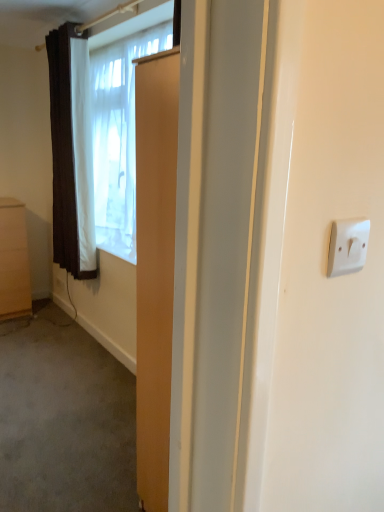
Locate an element on the screen. white sheer curtain at upper left is located at coordinates (72, 151).

This screenshot has height=512, width=384. In order to click on brown textured curtain at left in this screenshot , I will do `click(72, 152)`.

Identify the location of matte brown cabinet at left. (14, 260).

Which of these two, matte brown cabinet at left or white sheer curtain at upper left, is thinner?

Thinner between the two is white sheer curtain at upper left.

Is matte brown cabinet at left beside white sheer curtain at upper left?

No, matte brown cabinet at left is not making contact with white sheer curtain at upper left.

Can you confirm if matte brown cabinet at left is positioned to the right of white sheer curtain at upper left?

No, matte brown cabinet at left is not to the right of white sheer curtain at upper left.

How distant is matte brown cabinet at left from white sheer curtain at upper left?

The distance of matte brown cabinet at left from white sheer curtain at upper left is 90.15 centimeters.

Which is more to the left, brown textured curtain at left or matte brown cabinet at left?

matte brown cabinet at left is more to the left.

Where is `curtain above the matte brown cabinet at left (from the image's perspective)`? curtain above the matte brown cabinet at left (from the image's perspective) is located at coordinates (72, 152).

Is point (82, 128) closer or farther from the camera than point (10, 238)?

Clearly, point (82, 128) is closer to the camera than point (10, 238).

Considering the relative positions of brown textured curtain at left and matte brown cabinet at left in the image provided, is brown textured curtain at left in front of matte brown cabinet at left?

Yes, it is in front of matte brown cabinet at left.

Does point (78, 223) lie behind point (14, 285)?

That is False.

Can you confirm if white sheer curtain at upper left is wider than matte brown cabinet at left?

In fact, white sheer curtain at upper left might be narrower than matte brown cabinet at left.

Which object is positioned more to the right, white sheer curtain at upper left or matte brown cabinet at left?

white sheer curtain at upper left.

Would you say matte brown cabinet at left is part of white sheer curtain at upper left's contents?

No.

From the image's perspective, which one is positioned lower, brown textured curtain at left or white sheer curtain at upper left?

white sheer curtain at upper left, from the image's perspective.

Considering the relative positions of brown textured curtain at left and white sheer curtain at upper left in the image provided, is brown textured curtain at left behind white sheer curtain at upper left?

Yes, the depth of brown textured curtain at left is greater than that of white sheer curtain at upper left.

Looking at this image, could you tell me if brown textured curtain at left is turned towards white sheer curtain at upper left?

No, brown textured curtain at left is not turned towards white sheer curtain at upper left.

Between brown textured curtain at left and white sheer curtain at upper left, which one has more height?

With more height is brown textured curtain at left.

How far apart are matte brown cabinet at left and brown textured curtain at left?

matte brown cabinet at left and brown textured curtain at left are 32.20 inches apart from each other.

Is matte brown cabinet at left next to brown textured curtain at left?

matte brown cabinet at left and brown textured curtain at left are not in contact.

Can you confirm if matte brown cabinet at left is bigger than brown textured curtain at left?

Actually, matte brown cabinet at left might be smaller than brown textured curtain at left.

Is matte brown cabinet at left aimed at brown textured curtain at left?

No, matte brown cabinet at left does not turn towards brown textured curtain at left.

Between white sheer curtain at upper left and brown textured curtain at left, which one is positioned behind?

brown textured curtain at left is more distant.

At what (x,y) coordinates should I click in order to perform the action: click on window on the right of brown textured curtain at left. Please return your answer as a coordinate pair (x, y). The image size is (384, 512). Looking at the image, I should click on (72, 151).

Does white sheer curtain at upper left have a smaller size compared to brown textured curtain at left?

Actually, white sheer curtain at upper left might be larger than brown textured curtain at left.

Which is more to the left, white sheer curtain at upper left or brown textured curtain at left?

From the viewer's perspective, brown textured curtain at left appears more on the left side.

The image size is (384, 512). Find the location of `cabinetry that appears on the left of white sheer curtain at upper left`. cabinetry that appears on the left of white sheer curtain at upper left is located at coordinates (14, 260).

Where is `curtain that appears on the right of matte brown cabinet at left`? curtain that appears on the right of matte brown cabinet at left is located at coordinates (72, 152).

Estimate the real-world distances between objects in this image. Which object is closer to brown textured curtain at left, white sheer curtain at upper left or matte brown cabinet at left?

The object closer to brown textured curtain at left is white sheer curtain at upper left.

From the image, which object appears to be farther from brown textured curtain at left, matte brown cabinet at left or white sheer curtain at upper left?

The object further to brown textured curtain at left is matte brown cabinet at left.

From the image, which object appears to be farther from matte brown cabinet at left, white sheer curtain at upper left or brown textured curtain at left?

Among the two, white sheer curtain at upper left is located further to matte brown cabinet at left.

Considering their positions, is brown textured curtain at left positioned closer to matte brown cabinet at left than white sheer curtain at upper left?

brown textured curtain at left is closer to matte brown cabinet at left.

When comparing their distances from white sheer curtain at upper left, does brown textured curtain at left or matte brown cabinet at left seem closer?

brown textured curtain at left is positioned closer to the anchor white sheer curtain at upper left.

Estimate the real-world distances between objects in this image. Which object is further from white sheer curtain at upper left, matte brown cabinet at left or brown textured curtain at left?

Based on the image, matte brown cabinet at left appears to be further to white sheer curtain at upper left.

What are the coordinates of `curtain located between matte brown cabinet at left and white sheer curtain at upper left in the left-right direction` in the screenshot? It's located at (72, 152).